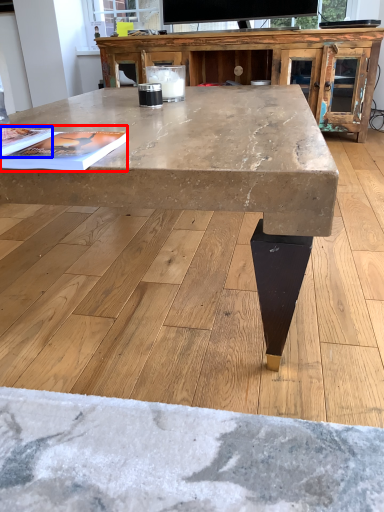
Question: Among these objects, which one is farthest to the camera, magazine (highlighted by a red box) or magazine (highlighted by a blue box)?

Choices:
 (A) magazine
 (B) magazine

Answer: (B)